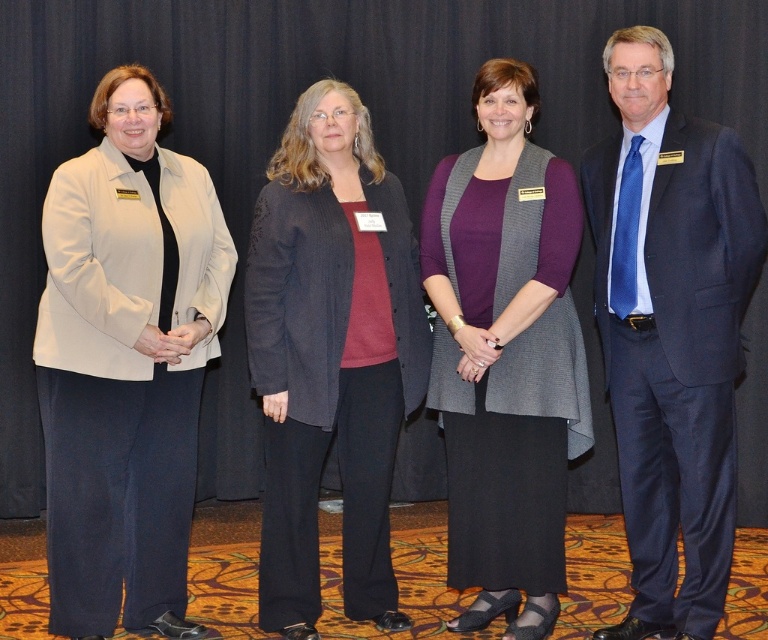
You are a photographer at a formal event. You need to adjust the lighting so that the blue textured suit at right and the purple matte sweater at center are both well lit. Since the backdrop is dark, you want to ensure that the edges of these two outfits are clearly visible. Which outfit should you focus on first to ensure it doesn not get lost against the dark background?

The blue textured suit at right is in front of the purple matte sweater at center. Therefore, you should focus on lighting the blue textured suit at right first because it is closer to the camera and might cast a shadow over the purple matte sweater at center, potentially making it harder to see the edges of the purple matte sweater at center against the dark backdrop.

You are standing in front of the image of four people against a dark curtain. There are two points marked in the image. The first point is at coordinates point (47,451) and the second is at point (657,104). Which point is closer to you?

The point at coordinates point (47,451) is closer to the viewer than point (657,104).